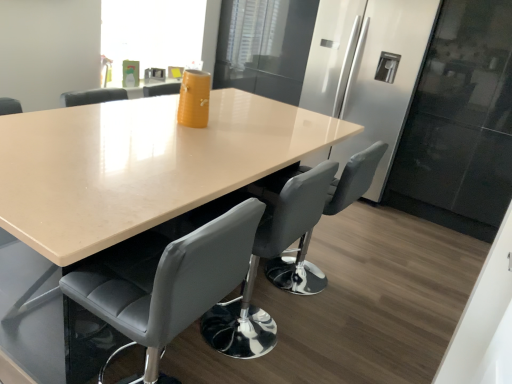
Find the location of a particular element. The width and height of the screenshot is (512, 384). free space above beige glossy table at center (from a real-world perspective) is located at coordinates (148, 136).